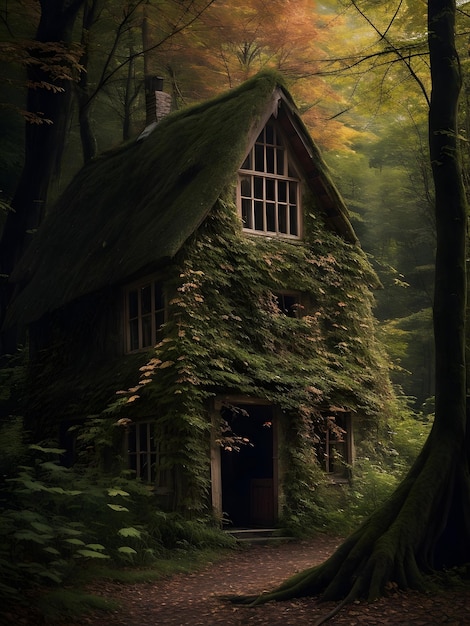
Locate an element on the screen. stone chimney is located at coordinates (150, 106).